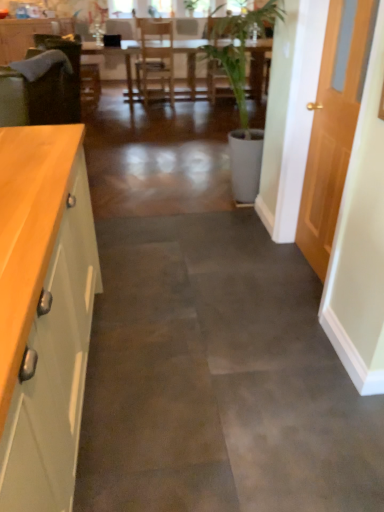
Question: From a real-world perspective, is green matte cabinet at left, the 2th cabinetry viewed from the left, physically below matte green cabinet at left, arranged as the first cabinetry when viewed from the back?

Choices:
 (A) yes
 (B) no

Answer: (A)

Question: Is green matte cabinet at left, placed as the first cabinetry when sorted from front to back, taller than matte green cabinet at left, which is the second cabinetry in front-to-back order?

Choices:
 (A) yes
 (B) no

Answer: (B)

Question: Does green matte cabinet at left, placed as the first cabinetry when sorted from front to back, have a lesser width compared to matte green cabinet at left, which is the second cabinetry in front-to-back order?

Choices:
 (A) no
 (B) yes

Answer: (A)

Question: From the image's perspective, is green matte cabinet at left, placed as the first cabinetry when sorted from front to back, located above matte green cabinet at left, which ranks as the 2th cabinetry in bottom-to-top order?

Choices:
 (A) no
 (B) yes

Answer: (A)

Question: Is matte green cabinet at left, placed as the second cabinetry when sorted from right to left, completely or partially inside green matte cabinet at left, the 2th cabinetry viewed from the left?

Choices:
 (A) yes
 (B) no

Answer: (B)

Question: Would you consider green matte cabinet at left, the 1th cabinetry in the right-to-left sequence, to be distant from matte green cabinet at left, which ranks as the 2th cabinetry in bottom-to-top order?

Choices:
 (A) yes
 (B) no

Answer: (A)

Question: Is wooden door at right outside of green matte cabinet at left, acting as the 2th cabinetry starting from the top?

Choices:
 (A) no
 (B) yes

Answer: (B)

Question: From the image's perspective, is wooden door at right located beneath green matte cabinet at left, the second cabinetry from the back?

Choices:
 (A) yes
 (B) no

Answer: (B)

Question: Is green matte cabinet at left, which is the first cabinetry in bottom-to-top order, inside wooden door at right?

Choices:
 (A) yes
 (B) no

Answer: (B)

Question: Considering the relative positions of wooden door at right and green matte cabinet at left, the 2th cabinetry viewed from the left, in the image provided, is wooden door at right to the right of green matte cabinet at left, the 2th cabinetry viewed from the left, from the viewer's perspective?

Choices:
 (A) no
 (B) yes

Answer: (B)

Question: Could you tell me if wooden door at right is turned towards green matte cabinet at left, placed as the first cabinetry when sorted from front to back?

Choices:
 (A) yes
 (B) no

Answer: (A)

Question: From the image's perspective, is wooden door at right on top of green matte cabinet at left, the second cabinetry from the back?

Choices:
 (A) yes
 (B) no

Answer: (A)

Question: Considering the relative sizes of green matte cabinet at left, the 1th cabinetry in the right-to-left sequence, and wooden table at center in the image provided, is green matte cabinet at left, the 1th cabinetry in the right-to-left sequence, thinner than wooden table at center?

Choices:
 (A) yes
 (B) no

Answer: (A)